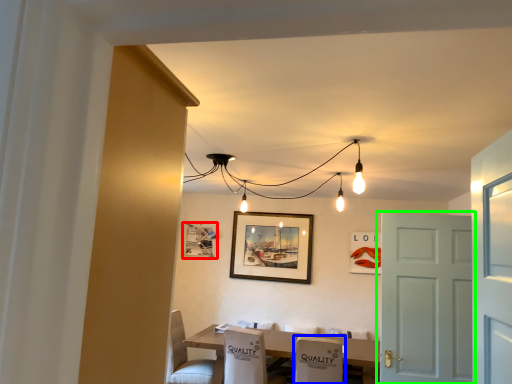
Question: Which object is the farthest from picture frame (highlighted by a red box)? Choose among these: armchair (highlighted by a blue box) or door (highlighted by a green box).

Choices:
 (A) armchair
 (B) door

Answer: (B)